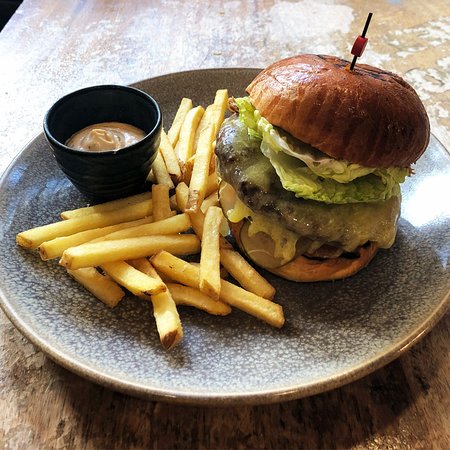
Identify the location of tabletop. This screenshot has height=450, width=450. (420, 416), (39, 50).